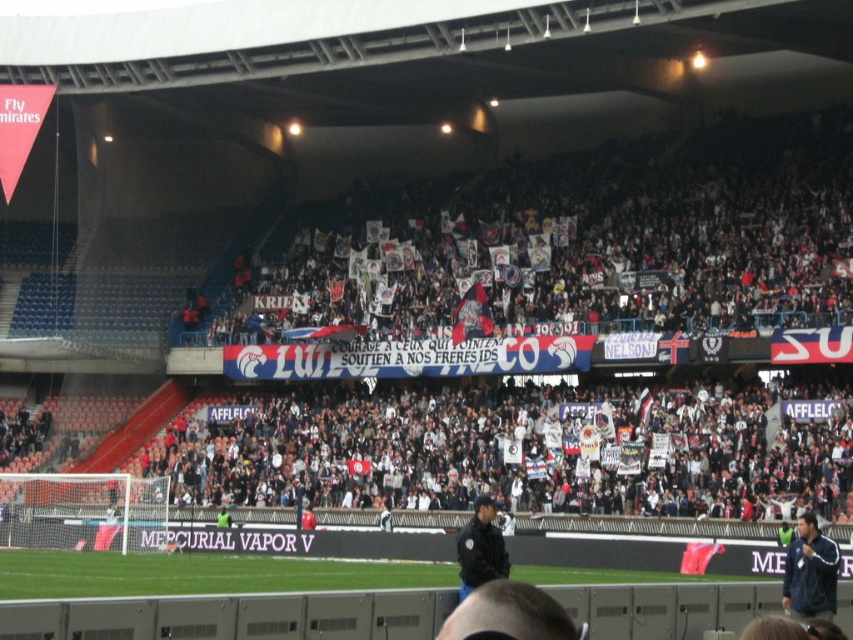
Question: Which of the following is the farthest from the observer?

Choices:
 (A) black uniform at center
 (B) blue fabric jacket at lower right

Answer: (A)

Question: Is blue fabric jacket at lower right smaller than black uniform at center?

Choices:
 (A) no
 (B) yes

Answer: (A)

Question: Which point is farther from the camera taking this photo?

Choices:
 (A) (488, 557)
 (B) (808, 570)

Answer: (A)

Question: Does blue fabric jacket at lower right appear on the right side of black uniform at center?

Choices:
 (A) yes
 (B) no

Answer: (A)

Question: Does blue fabric jacket at lower right appear on the left side of black uniform at center?

Choices:
 (A) no
 (B) yes

Answer: (A)